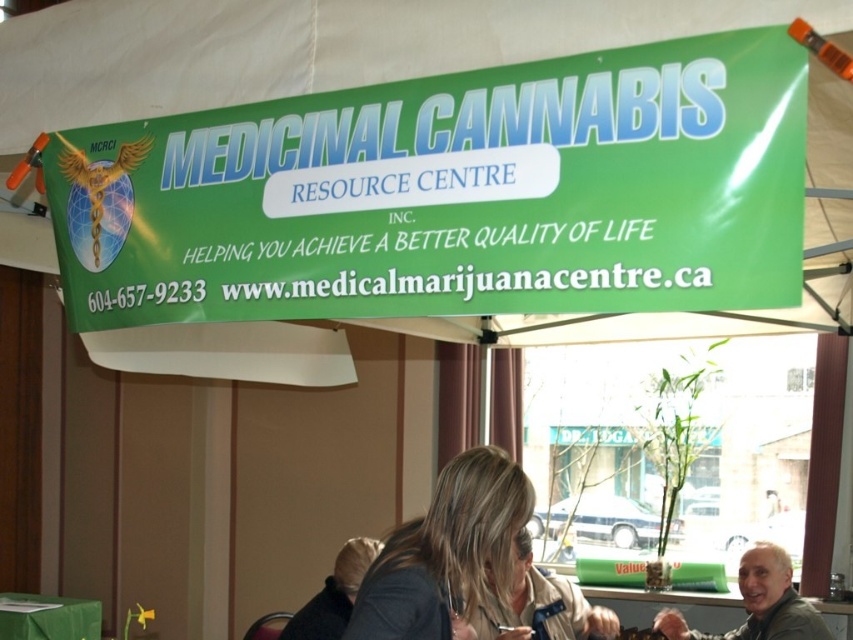
You are a photographer at an event and want to capture a photo of the blonde hair at center and the green fabric table at lower left. Which object should you focus on first if you want to emphasize the larger object in your shot?

The blonde hair at center is bigger than the green fabric table at lower left, so you should focus on the blonde hair at center first to emphasize its larger size.

You are at an event and want to find the contact information for the Medicinal Cannabis Resource Centre Inc. You see the green matte banner at upper center and the gray fabric jacket at lower right. Which object should you look at to find the contact details?

The contact information is on the green matte banner at upper center, so you should look at the green matte banner at upper center.